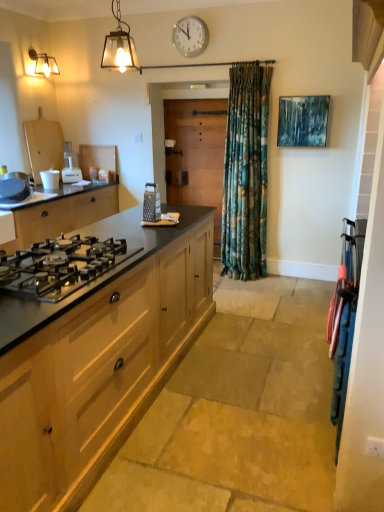
Image resolution: width=384 pixels, height=512 pixels. I want to click on unoccupied space behind blue metallic suitcase at right, the 1th appliance viewed from the right, so 298,333.